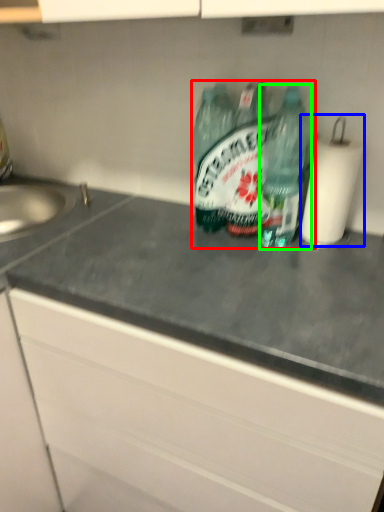
Question: Which object is positioned closest to bottle (highlighted by a red box)? Select from paper towel (highlighted by a blue box) and bottle (highlighted by a green box).

Choices:
 (A) paper towel
 (B) bottle

Answer: (B)